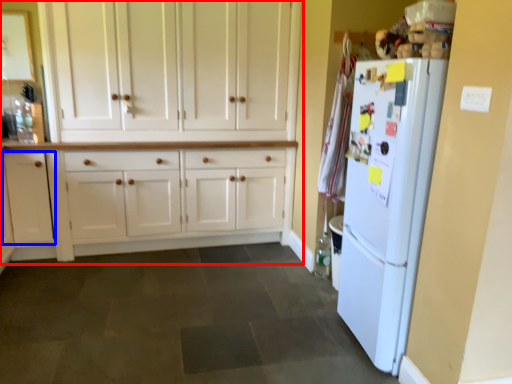
Question: Which object is further to the camera taking this photo, cabinetry (highlighted by a red box) or cabinetry (highlighted by a blue box)?

Choices:
 (A) cabinetry
 (B) cabinetry

Answer: (B)